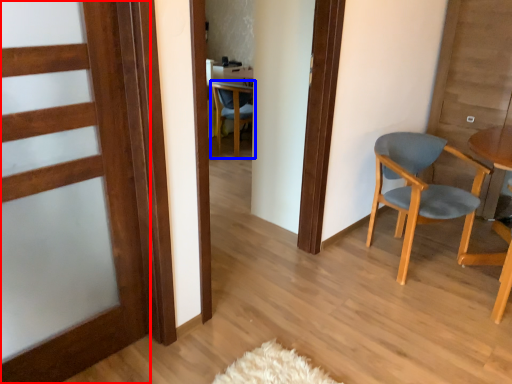
Question: Which object is closer to the camera taking this photo, door (highlighted by a red box) or chair (highlighted by a blue box)?

Choices:
 (A) door
 (B) chair

Answer: (A)